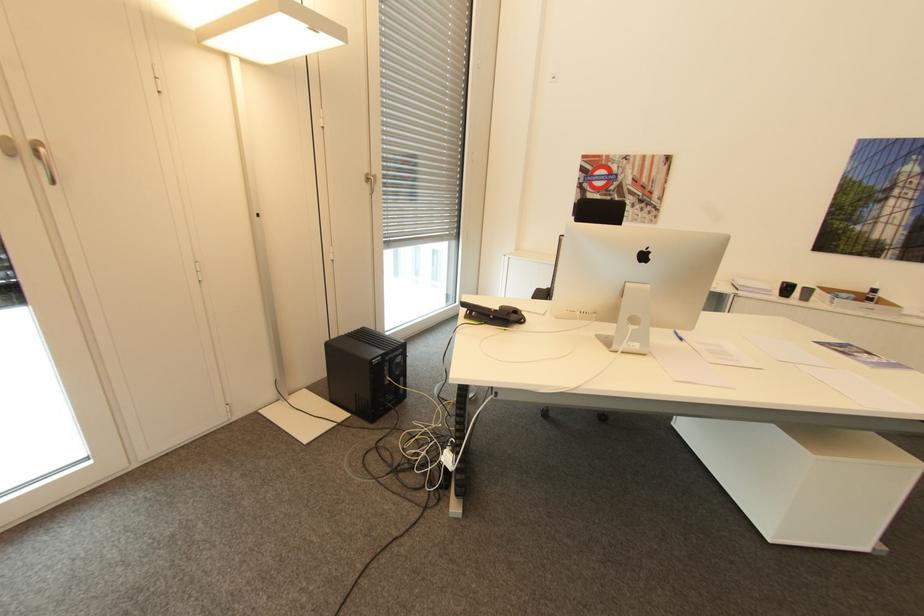
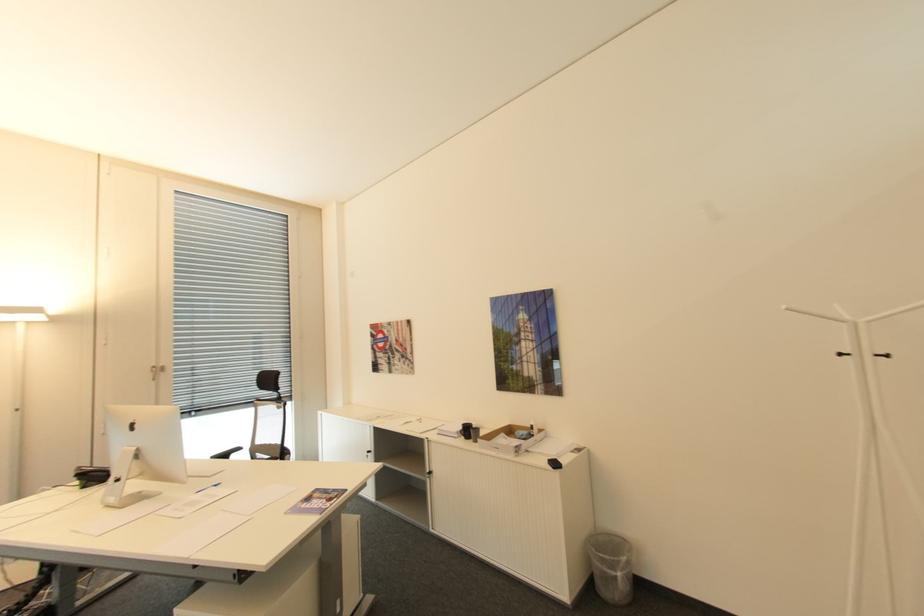
In the second image, find the point that corresponds to the point at 655,256 in the first image.

(140, 426)